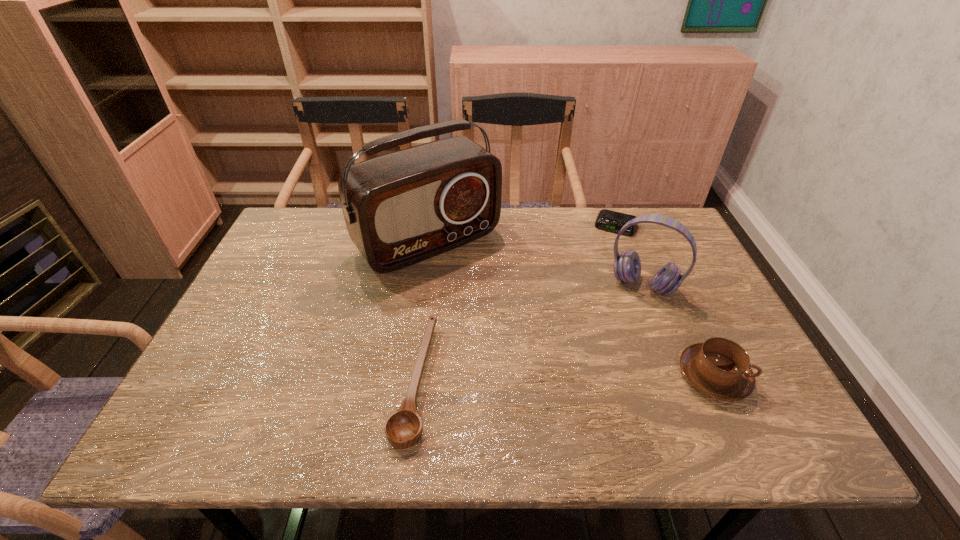
Where is `the second shortest object`? the second shortest object is located at coordinates (403, 428).

Image resolution: width=960 pixels, height=540 pixels. I want to click on the third tallest object, so click(x=719, y=368).

Locate an element on the screen. alarm clock is located at coordinates (608, 220).

The height and width of the screenshot is (540, 960). Identify the location of the tallest object. (401, 208).

You are a GUI agent. You are given a task and a screenshot of the screen. Output one action in this format:
    pyautogui.click(x=<x>, y=<y>)
    Task: Click on the headset
    Image resolution: width=960 pixels, height=540 pixels.
    Given the screenshot: What is the action you would take?
    pyautogui.click(x=627, y=267)

In order to click on free space located on the back of the second shortest object in this screenshot , I will do `click(431, 247)`.

Image resolution: width=960 pixels, height=540 pixels. I want to click on free space located on the display of the shortest object, so click(x=594, y=282).

You are a GUI agent. You are given a task and a screenshot of the screen. Output one action in this format:
    pyautogui.click(x=<x>, y=<y>)
    Task: Click on the vacant space located on the display of the shortest object
    The width and height of the screenshot is (960, 540).
    Given the screenshot: What is the action you would take?
    pyautogui.click(x=602, y=261)

The width and height of the screenshot is (960, 540). I want to click on blank area located 0.400m on the display of the shortest object, so click(578, 325).

You are a GUI agent. You are given a task and a screenshot of the screen. Output one action in this format:
    pyautogui.click(x=<x>, y=<y>)
    Task: Click on the free region located 0.140m on the front panel of the radio receiver
    This screenshot has width=960, height=540.
    Given the screenshot: What is the action you would take?
    pyautogui.click(x=495, y=305)